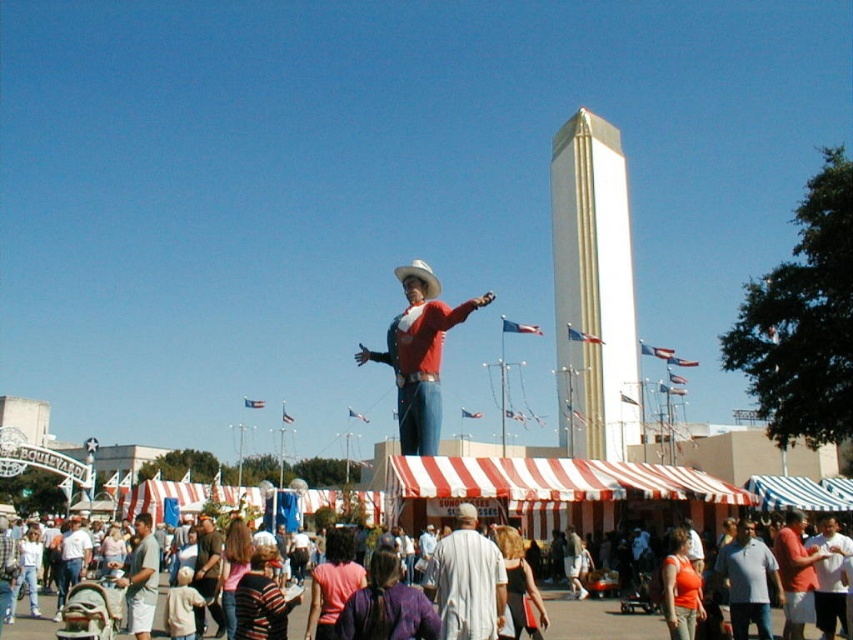
Question: Considering the real-world distances, which object is closest to the denim jeans at lower center?

Choices:
 (A) light brown shirt at lower left
 (B) matte red shirt at center
 (C) white smooth obelisk at center
 (D) light gray cotton shirt at center

Answer: (D)

Question: Does matte red shirt at center lie in front of denim jeans at lower center?

Choices:
 (A) no
 (B) yes

Answer: (A)

Question: Which point appears farthest from the camera in this image?

Choices:
 (A) (149, 566)
 (B) (589, 452)
 (C) (401, 316)
 (D) (4, 632)

Answer: (B)

Question: Is white smooth obelisk at center above matte red shirt at center?

Choices:
 (A) no
 (B) yes

Answer: (B)

Question: Which object is farther from the camera taking this photo?

Choices:
 (A) denim jeans at lower center
 (B) light gray cotton shirt at center
 (C) matte red shirt at center

Answer: (C)

Question: Is light gray cotton shirt at center above light brown shirt at lower left?

Choices:
 (A) yes
 (B) no

Answer: (A)